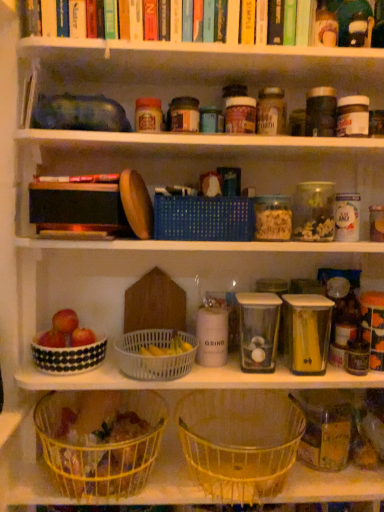
Question: Is red matte apple at lower left, arranged as the 1th apple when viewed from the right, spatially inside yellow wire basket at lower center, which ranks as the 2th basket in bottom-to-top order, or outside of it?

Choices:
 (A) outside
 (B) inside

Answer: (A)

Question: Considering the positions of red matte apple at lower left, acting as the second apple starting from the left, and yellow wire basket at lower center, which ranks as the 2th basket in bottom-to-top order, in the image, is red matte apple at lower left, acting as the second apple starting from the left, bigger or smaller than yellow wire basket at lower center, which ranks as the 2th basket in bottom-to-top order,?

Choices:
 (A) big
 (B) small

Answer: (B)

Question: Which of these objects is positioned farthest from the yellow wire basket at lower center, which ranks as the 2th basket in bottom-to-top order?

Choices:
 (A) red matte apple at lower left, arranged as the 1th apple when viewed from the right
 (B) transparent plastic container at center, which is the third glass jar from right to left
 (C) yellow wire basket at lower center, which ranks as the 4th basket in top-to-bottom order
 (D) red matte apple at lower left, which is counted as the first apple, starting from the left
 (E) white speckled ceramic bowl at lower left

Answer: (D)

Question: Which object is positioned farthest from the red matte apple at lower left, arranged as the 1th apple when viewed from the right?

Choices:
 (A) white plastic basket at center, the 2th basket viewed from the top
 (B) yellow wire basket at lower center, the first basket when ordered from bottom to top
 (C) yellow wire basket at lower center, marked as the 3th basket in a top-to-bottom arrangement
 (D) transparent plastic container at center, marked as the 1th glass jar in a left-to-right arrangement
 (E) white speckled ceramic bowl at lower left

Answer: (C)